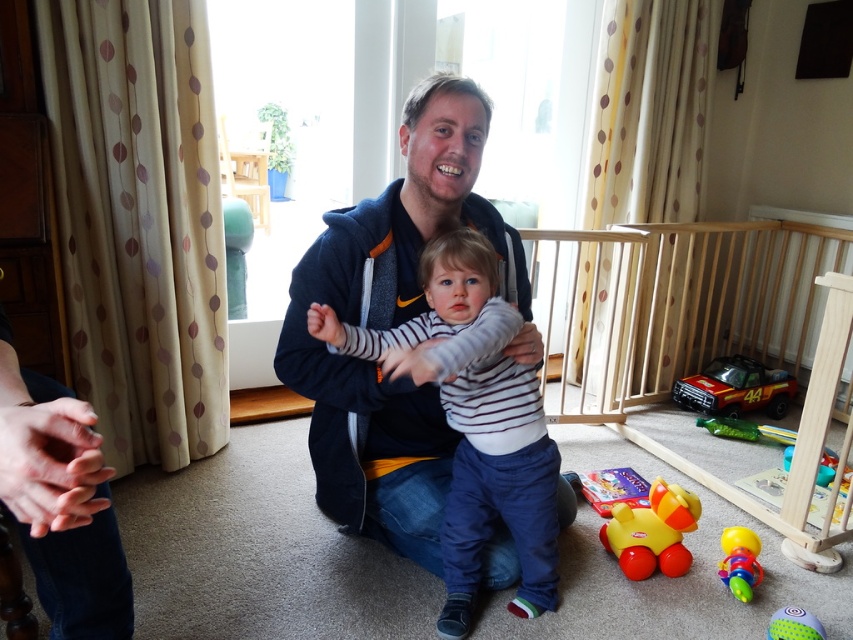
Who is more distant from viewer, [532,548] or [817,634]?

Positioned behind is point [532,548].

Who is lower down, striped cotton shirt at center or smooth rubber ball at lower right?

smooth rubber ball at lower right is below.

The height and width of the screenshot is (640, 853). I want to click on striped cotton shirt at center, so click(473, 420).

The height and width of the screenshot is (640, 853). Identify the location of striped cotton shirt at center. pyautogui.click(x=473, y=420).

Is point (728, 528) farther from viewer compared to point (770, 625)?

That is True.

Who is higher up, rubberized plastic rattle at lower right or smooth rubber ball at lower right?

rubberized plastic rattle at lower right is above.

Locate an element on the screen. This screenshot has width=853, height=640. rubberized plastic rattle at lower right is located at coordinates (740, 561).

Can you confirm if striped cotton shirt at center is wider than rubber duck at lower center?

Yes.

Measure the distance between striped cotton shirt at center and camera.

A distance of 1.11 meters exists between striped cotton shirt at center and camera.

You are a GUI agent. You are given a task and a screenshot of the screen. Output one action in this format:
    pyautogui.click(x=<x>, y=<y>)
    Task: Click on the striped cotton shirt at center
    The height and width of the screenshot is (640, 853).
    Given the screenshot: What is the action you would take?
    pyautogui.click(x=473, y=420)